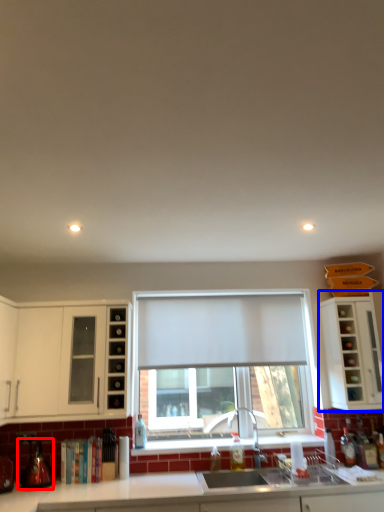
Question: Which of the following is the farthest to the observer, appliance (highlighted by a red box) or cabinetry (highlighted by a blue box)?

Choices:
 (A) appliance
 (B) cabinetry

Answer: (B)